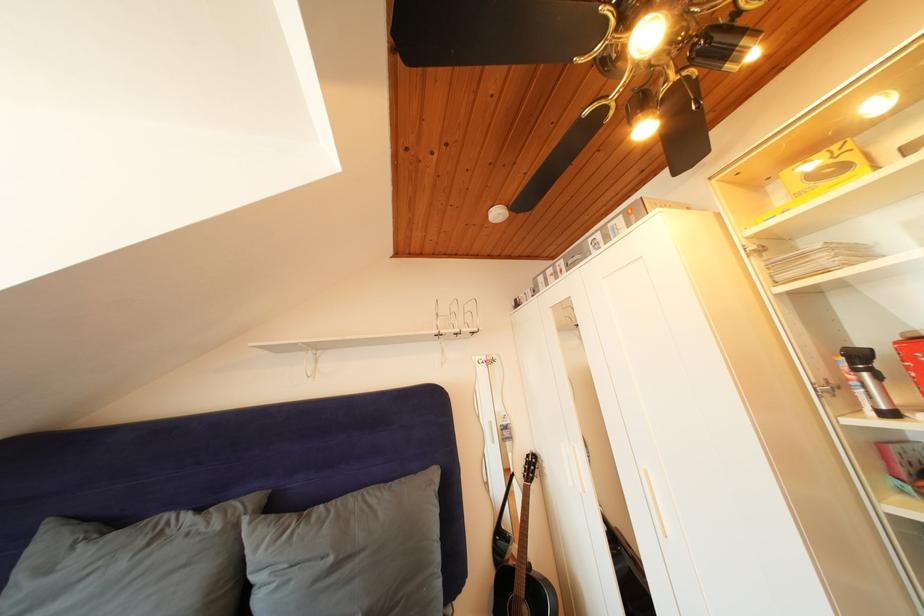
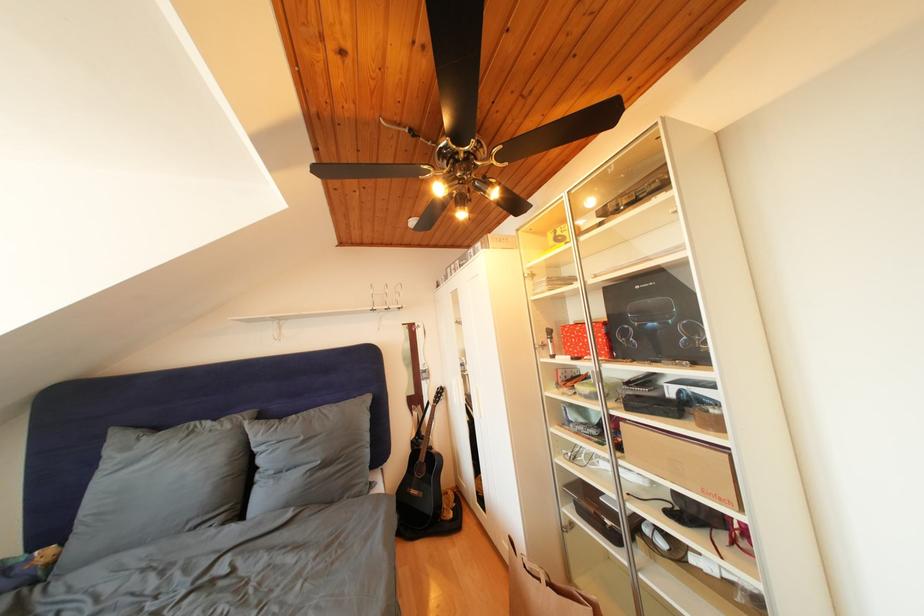
The point at (225, 531) is marked in the first image. Where is the corresponding point in the second image?

(236, 432)